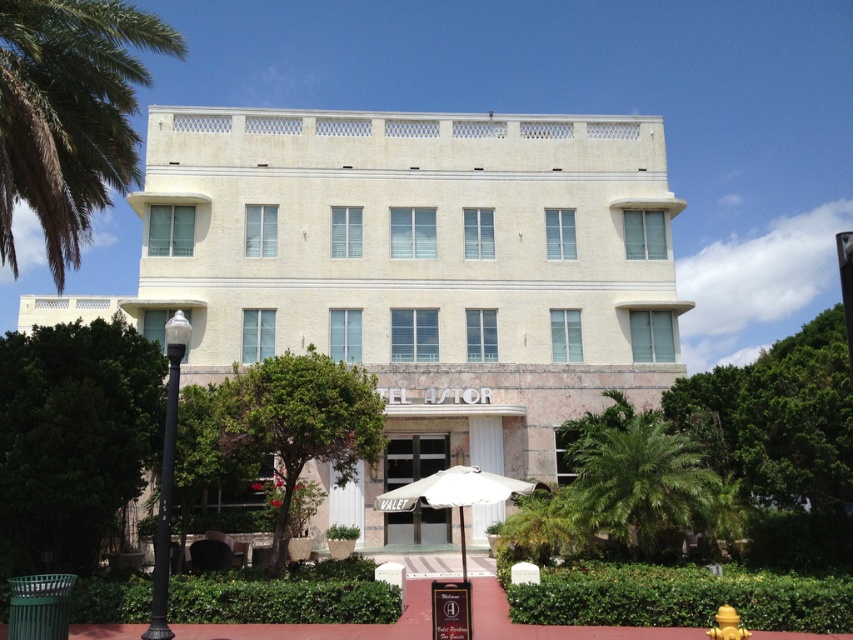
Question: Based on their relative distances, which object is farther from the yellow matte hydrant at lower right?

Choices:
 (A) white marble building at center
 (B) green leafy palm tree at lower right
 (C) green leafy palm tree at upper left

Answer: (C)

Question: Considering the real-world distances, which object is farthest from the green leafy palm tree at upper left?

Choices:
 (A) white fabric umbrella at center
 (B) green leafy palm tree at lower right
 (C) white marble building at center

Answer: (B)

Question: Can you confirm if green leafy palm tree at upper left is thinner than yellow matte hydrant at lower right?

Choices:
 (A) yes
 (B) no

Answer: (B)

Question: Which point is farther from the camera taking this photo?

Choices:
 (A) (727, 608)
 (B) (409, 160)
 (C) (605, 460)
 (D) (10, 56)

Answer: (B)

Question: Is green leafy palm tree at lower right wider than yellow matte hydrant at lower right?

Choices:
 (A) no
 (B) yes

Answer: (A)

Question: Can you confirm if white marble building at center is bigger than green leafy palm tree at upper left?

Choices:
 (A) yes
 (B) no

Answer: (B)